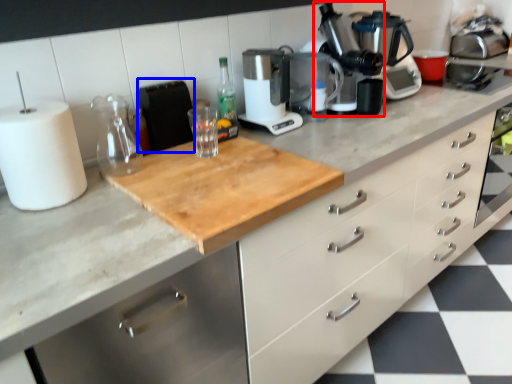
Question: Which object appears farthest to the camera in this image, coffee machine (highlighted by a red box) or appliance (highlighted by a blue box)?

Choices:
 (A) coffee machine
 (B) appliance

Answer: (A)